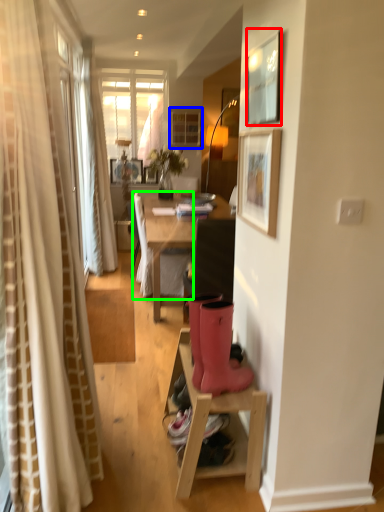
Question: Which object is positioned farthest from picture frame (highlighted by a red box)? Select from cabinetry (highlighted by a blue box) and chair (highlighted by a green box).

Choices:
 (A) cabinetry
 (B) chair

Answer: (A)